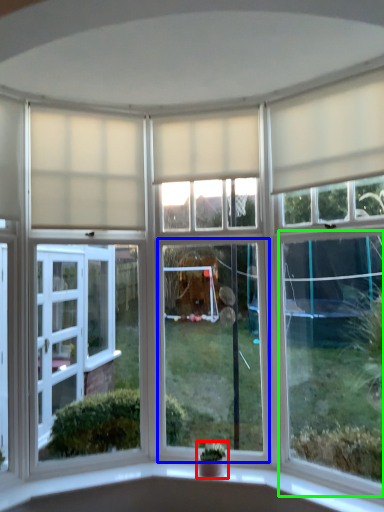
Question: Which is farther away from houseplant (highlighted by a red box)? window (highlighted by a blue box) or window (highlighted by a green box)?

Choices:
 (A) window
 (B) window

Answer: (B)